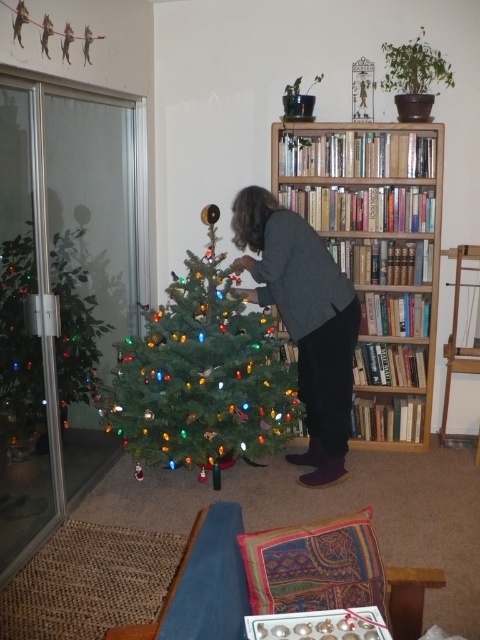
You are standing in the living room and want to place a new decoration on the wooden bookcase at right. If you can reach up to 2 meters, will you be able to reach the top of the bookcase?

The wooden bookcase at right is 3.29 meters away from the viewer. Since the distance is greater than the 2 meters you can reach, you will not be able to reach the top of the wooden bookcase at right.

Consider the image. You are standing in the living room and want to place a 3.5 meter long ladder against the wall. The wooden bookcase at right is 3.29 meters away from you. Is there enough space between you and the bookcase to safely place the ladder?

The wooden bookcase at right is 3.29 meters from viewer. The ladder is 3.5 meters long, so there isn